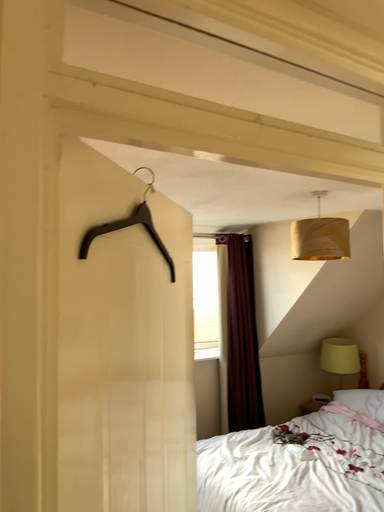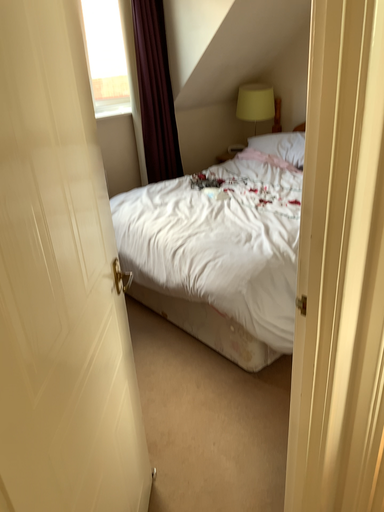
Question: How did the camera likely rotate when shooting the video?

Choices:
 (A) rotated upward
 (B) rotated downward

Answer: (B)